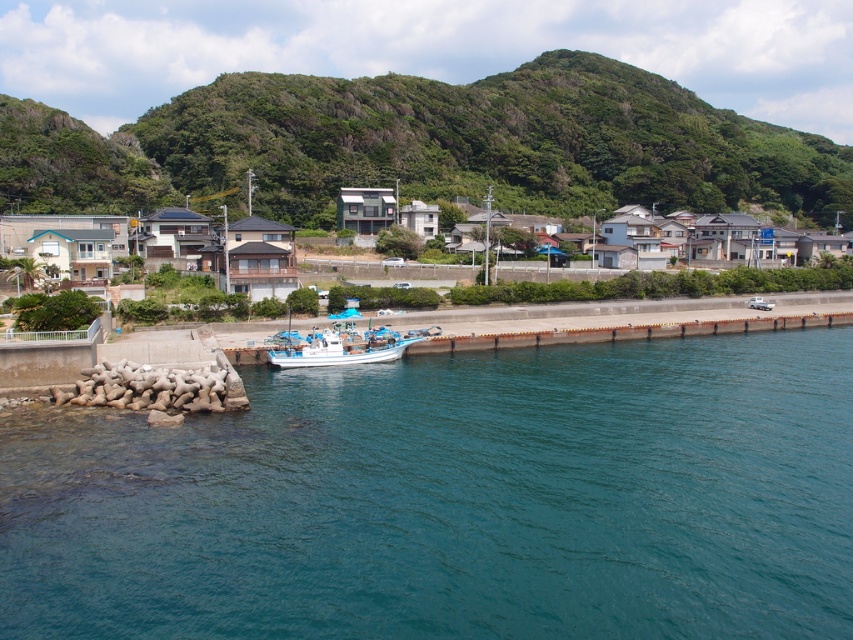
Consider the image. You are a photographer standing at the edge of the concrete dock at center, aiming to capture the teal water at lower center in your shot. Based on their relative heights, will the water appear higher or lower in the frame compared to the dock?

The teal water at lower center is much taller than the concrete dock at center, so in the photograph, the water will appear higher in the frame compared to the dock.

You are a photographer wanting to capture both the teal water at lower center and the white plastic boat at center in a single frame. Given their sizes, which object should you position closer to the center of your camera frame to ensure both fit well?

Since the teal water at lower center is wider than the white plastic boat at center, positioning the teal water at lower center closer to the center of the camera frame will allow both objects to fit well within the shot.

You are standing at the edge of the concrete dock at center and want to see the teal water at lower center. In which direction should you look?

The teal water at lower center is below the concrete dock at center, so you should look downward to see it.